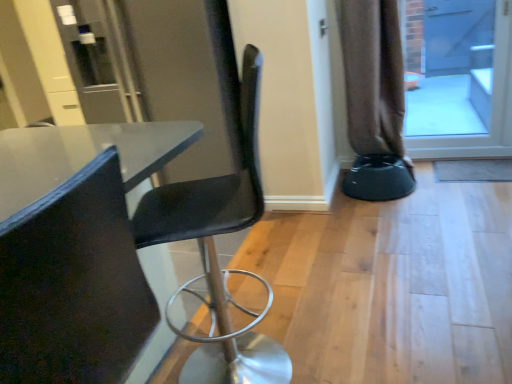
What do you see at coordinates (492, 108) in the screenshot?
I see `blue glass screen door at upper right` at bounding box center [492, 108].

What do you see at coordinates (216, 253) in the screenshot? I see `matte black chair at center, which is the second chair in front-to-back order` at bounding box center [216, 253].

The width and height of the screenshot is (512, 384). In order to click on black plastic bar stool at lower right in this screenshot , I will do `click(378, 178)`.

Is brown fabric curtain at right oriented towards blue glass screen door at upper right?

No.

Considering the relative sizes of brown fabric curtain at right and blue glass screen door at upper right in the image provided, is brown fabric curtain at right bigger than blue glass screen door at upper right?

Indeed, brown fabric curtain at right has a larger size compared to blue glass screen door at upper right.

Are brown fabric curtain at right and blue glass screen door at upper right located far from each other?

Actually, brown fabric curtain at right and blue glass screen door at upper right are a little close together.

Can you confirm if brown fabric curtain at right is thinner than blue glass screen door at upper right?

No, brown fabric curtain at right is not thinner than blue glass screen door at upper right.

Does blue glass screen door at upper right lie in front of matte black chair at left, which is the first chair in front-to-back order?

No.

Which is closer, (x=479, y=135) or (x=6, y=250)?

Point (x=479, y=135) is positioned farther from the camera compared to point (x=6, y=250).

Between blue glass screen door at upper right and matte black chair at left, which is the first chair in front-to-back order, which one appears on the right side from the viewer's perspective?

blue glass screen door at upper right is more to the right.

Looking at this image, considering the relative sizes of black plastic bar stool at lower right and blue glass screen door at upper right in the image provided, is black plastic bar stool at lower right wider than blue glass screen door at upper right?

Yes.

The image size is (512, 384). I want to click on screen door on the right of black plastic bar stool at lower right, so click(x=492, y=108).

In the scene shown: Is black plastic bar stool at lower right beside blue glass screen door at upper right?

They are not placed beside each other.

Based on the photo, is black plastic bar stool at lower right far away from matte black chair at center, which is the second chair in front-to-back order?

Yes, black plastic bar stool at lower right is far from matte black chair at center, which is the second chair in front-to-back order.

In order to click on chair that is the 1st object above the black plastic bar stool at lower right (from a real-world perspective) in this screenshot , I will do `click(216, 253)`.

Considering the relative sizes of black plastic bar stool at lower right and matte black chair at center, which is the second chair in front-to-back order, in the image provided, is black plastic bar stool at lower right smaller than matte black chair at center, which is the second chair in front-to-back order,?

Yes.

Is point (348, 172) positioned after point (253, 52)?

Yes, it is behind point (253, 52).

From a real-world perspective, is brown fabric curtain at right physically below black plastic bar stool at lower right?

Incorrect, from a real-world perspective, brown fabric curtain at right is higher than black plastic bar stool at lower right.

Is brown fabric curtain at right positioned with its back to black plastic bar stool at lower right?

No.

Between brown fabric curtain at right and black plastic bar stool at lower right, which one is positioned in front?

brown fabric curtain at right is closer to the camera.

Is brown fabric curtain at right further to camera compared to matte black chair at left, positioned as the second chair in back-to-front order?

Yes, brown fabric curtain at right is behind matte black chair at left, positioned as the second chair in back-to-front order.

Between brown fabric curtain at right and matte black chair at left, positioned as the second chair in back-to-front order, which one appears on the left side from the viewer's perspective?

Positioned to the left is matte black chair at left, positioned as the second chair in back-to-front order.

Considering the sizes of objects brown fabric curtain at right and matte black chair at left, which is the first chair in front-to-back order, in the image provided, who is shorter, brown fabric curtain at right or matte black chair at left, which is the first chair in front-to-back order,?

Standing shorter between the two is matte black chair at left, which is the first chair in front-to-back order.

Which of these two, brown fabric curtain at right or matte black chair at left, positioned as the second chair in back-to-front order, is wider?

Wider between the two is matte black chair at left, positioned as the second chair in back-to-front order.

Would you say brown fabric curtain at right is a long distance from matte black chair at center, arranged as the first chair when viewed from the back?

That's right, there is a large distance between brown fabric curtain at right and matte black chair at center, arranged as the first chair when viewed from the back.

Could you tell me if brown fabric curtain at right is turned towards matte black chair at center, arranged as the first chair when viewed from the back?

Yes, brown fabric curtain at right is oriented towards matte black chair at center, arranged as the first chair when viewed from the back.

Is brown fabric curtain at right in front of or behind matte black chair at center, which is the second chair in front-to-back order, in the image?

brown fabric curtain at right is positioned farther from the viewer than matte black chair at center, which is the second chair in front-to-back order.

Which of these two, brown fabric curtain at right or matte black chair at center, arranged as the first chair when viewed from the back, stands shorter?

brown fabric curtain at right is shorter.

Identify the location of curtain on the left of blue glass screen door at upper right. (373, 77).

The height and width of the screenshot is (384, 512). Identify the location of screen door below the matte black chair at left, which is the first chair in front-to-back order (from a real-world perspective). (492, 108).

When comparing their distances from blue glass screen door at upper right, does black plastic bar stool at lower right or matte black chair at center, arranged as the first chair when viewed from the back, seem further?

matte black chair at center, arranged as the first chair when viewed from the back, lies further to blue glass screen door at upper right than the other object.

Looking at the image, which one is located closer to brown fabric curtain at right, matte black chair at left, which is the first chair in front-to-back order, or blue glass screen door at upper right?

Based on the image, blue glass screen door at upper right appears to be nearer to brown fabric curtain at right.

From the image, which object appears to be farther from matte black chair at left, positioned as the second chair in back-to-front order, black plastic bar stool at lower right or blue glass screen door at upper right?

blue glass screen door at upper right lies further to matte black chair at left, positioned as the second chair in back-to-front order, than the other object.

From the image, which object appears to be nearer to brown fabric curtain at right, blue glass screen door at upper right or matte black chair at center, which is the second chair in front-to-back order?

blue glass screen door at upper right is closer to brown fabric curtain at right.

Consider the image. From the image, which object appears to be nearer to matte black chair at center, arranged as the first chair when viewed from the back, blue glass screen door at upper right or brown fabric curtain at right?

The object closer to matte black chair at center, arranged as the first chair when viewed from the back, is brown fabric curtain at right.

When comparing their distances from matte black chair at center, arranged as the first chair when viewed from the back, does matte black chair at left, positioned as the second chair in back-to-front order, or brown fabric curtain at right seem further?

brown fabric curtain at right is further to matte black chair at center, arranged as the first chair when viewed from the back.

Based on their spatial positions, is black plastic bar stool at lower right or brown fabric curtain at right closer to matte black chair at center, which is the second chair in front-to-back order?

black plastic bar stool at lower right.

Which object lies nearer to the anchor point matte black chair at left, which is the first chair in front-to-back order, matte black chair at center, arranged as the first chair when viewed from the back, or brown fabric curtain at right?

matte black chair at center, arranged as the first chair when viewed from the back, is closer to matte black chair at left, which is the first chair in front-to-back order.

Find the location of a particular element. This screenshot has height=384, width=512. bar stool positioned between matte black chair at center, arranged as the first chair when viewed from the back, and blue glass screen door at upper right from near to far is located at coordinates (378, 178).

Identify the location of curtain positioned between matte black chair at left, which is the first chair in front-to-back order, and blue glass screen door at upper right from near to far. The width and height of the screenshot is (512, 384). (373, 77).

Locate an element on the screen. curtain between matte black chair at center, arranged as the first chair when viewed from the back, and black plastic bar stool at lower right from front to back is located at coordinates (373, 77).

Where is `bar stool located between matte black chair at left, which is the first chair in front-to-back order, and blue glass screen door at upper right in the depth direction`? The image size is (512, 384). bar stool located between matte black chair at left, which is the first chair in front-to-back order, and blue glass screen door at upper right in the depth direction is located at coordinates (378, 178).